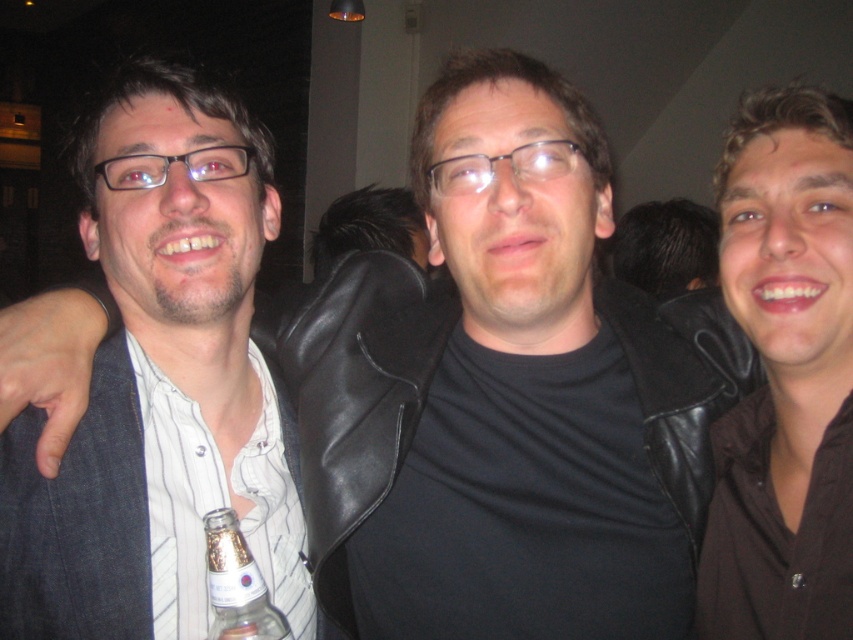
Can you confirm if clear plastic glasses at center is positioned to the left of matte black glasses at center?

Incorrect, clear plastic glasses at center is not on the left side of matte black glasses at center.

Is clear plastic glasses at center bigger than matte black glasses at center?

Actually, clear plastic glasses at center might be smaller than matte black glasses at center.

This screenshot has height=640, width=853. I want to click on clear plastic glasses at center, so click(502, 160).

Can you confirm if white striped shirt at left is positioned to the left of clear glass bottle at center?

Yes, white striped shirt at left is to the left of clear glass bottle at center.

Can you confirm if white striped shirt at left is shorter than clear glass bottle at center?

Incorrect, white striped shirt at left's height does not fall short of clear glass bottle at center's.

Locate an element on the screen. This screenshot has width=853, height=640. white striped shirt at left is located at coordinates (160, 392).

Locate an element on the screen. This screenshot has height=640, width=853. white striped shirt at left is located at coordinates (160, 392).

Is white striped shirt at left above clear plastic glasses at center?

Actually, white striped shirt at left is below clear plastic glasses at center.

Measure the distance between white striped shirt at left and clear plastic glasses at center.

white striped shirt at left is 12.87 inches away from clear plastic glasses at center.

Which is behind, point (109, 204) or point (457, 170)?

Point (109, 204)

You are a GUI agent. You are given a task and a screenshot of the screen. Output one action in this format:
    pyautogui.click(x=<x>, y=<y>)
    Task: Click on the white striped shirt at left
    The height and width of the screenshot is (640, 853).
    Given the screenshot: What is the action you would take?
    pyautogui.click(x=160, y=392)